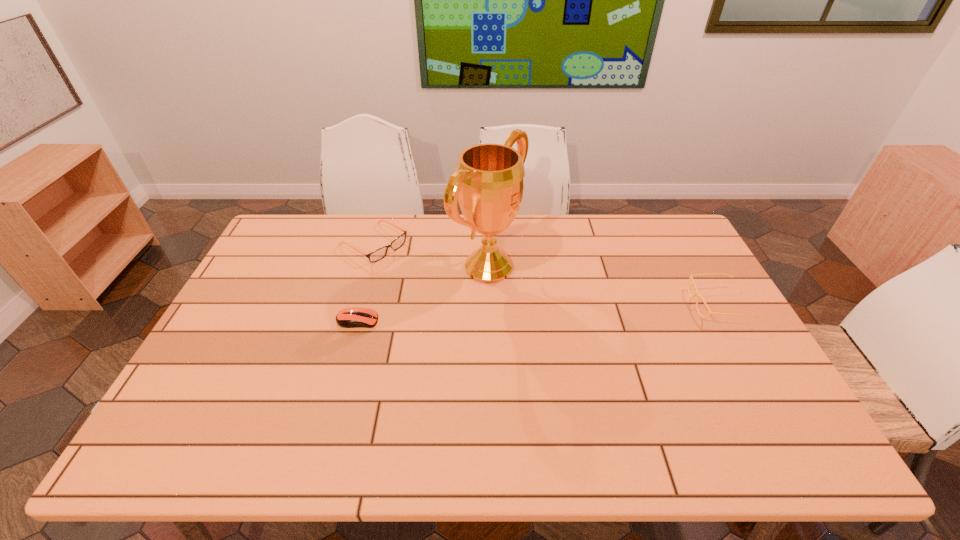
Locate an element on the screen. The image size is (960, 540). empty space between the shortest object and the second object from right to left is located at coordinates (423, 294).

Locate an element on the screen. The width and height of the screenshot is (960, 540). vacant region between the farther spectacles and the right spectacles is located at coordinates (545, 274).

Identify the location of empty space that is in between the left spectacles and the award. The height and width of the screenshot is (540, 960). (431, 255).

Identify which object is located as the nearest to the tallest object. Please provide its 2D coordinates. Your answer should be formatted as a tuple, i.e. [(x, y)], where the tuple contains the x and y coordinates of a point satisfying the conditions above.

[(380, 253)]

Locate which object is the third closest to the right spectacles. Please provide its 2D coordinates. Your answer should be formatted as a tuple, i.e. [(x, y)], where the tuple contains the x and y coordinates of a point satisfying the conditions above.

[(350, 317)]

You are a GUI agent. You are given a task and a screenshot of the screen. Output one action in this format:
    pyautogui.click(x=<x>, y=<y>)
    Task: Click on the vacant space that satisfies the following two spatial constraints: 1. on the back side of the right spectacles; 2. in front of the lenses of the shortest object
    Image resolution: width=960 pixels, height=540 pixels.
    Given the screenshot: What is the action you would take?
    pyautogui.click(x=362, y=304)

You are a GUI agent. You are given a task and a screenshot of the screen. Output one action in this format:
    pyautogui.click(x=<x>, y=<y>)
    Task: Click on the vacant area that satisfies the following two spatial constraints: 1. on the front side of the nearer spectacles; 2. in front of the lenses of the tallest object
    The image size is (960, 540).
    Given the screenshot: What is the action you would take?
    pyautogui.click(x=490, y=304)

Locate an element on the screen. The height and width of the screenshot is (540, 960). vacant space that satisfies the following two spatial constraints: 1. on the front side of the nearer spectacles; 2. in front of the lenses of the left spectacles is located at coordinates (356, 304).

Find the location of a particular element. The image size is (960, 540). free region that satisfies the following two spatial constraints: 1. on the front side of the tallest object; 2. in front of the lenses of the nearer spectacles is located at coordinates (490, 304).